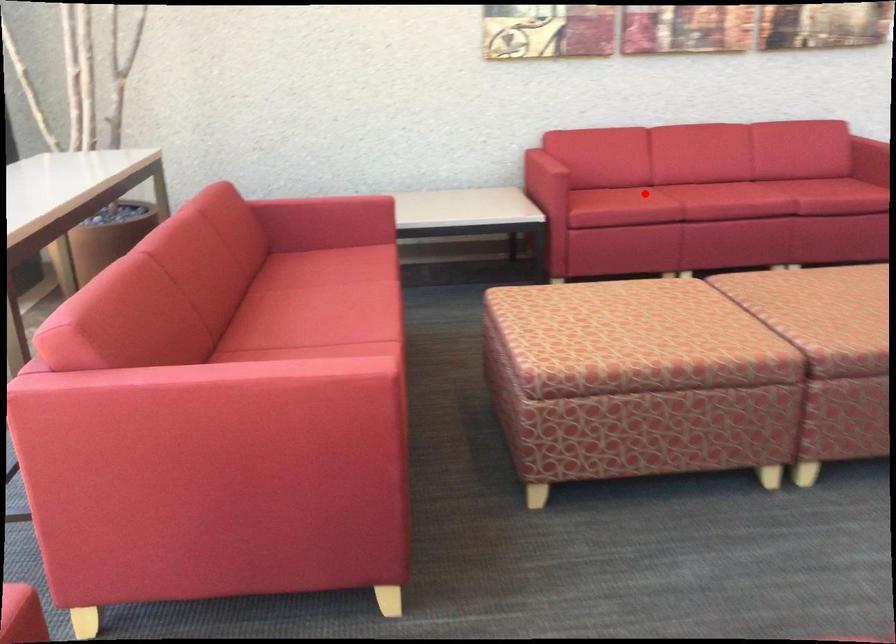
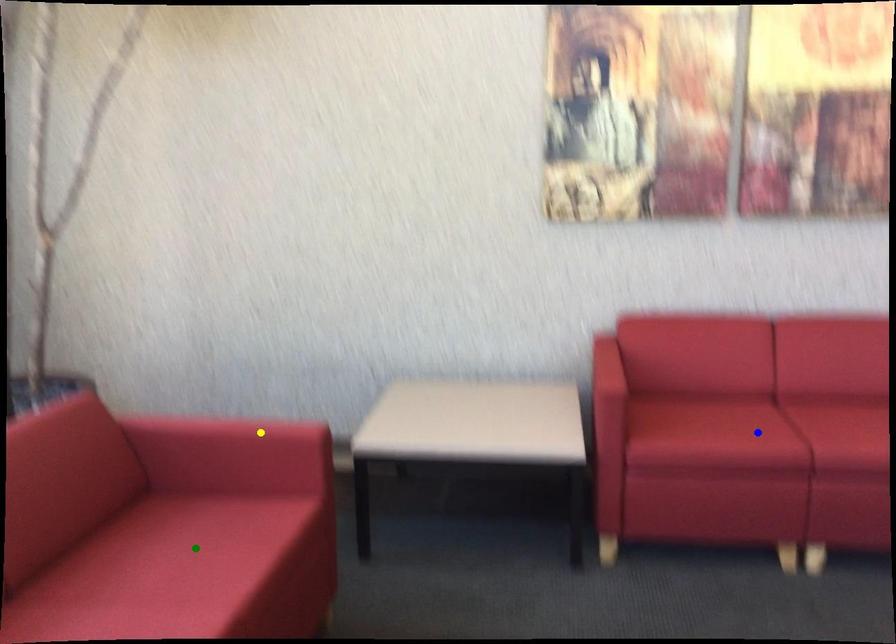
Question: I am providing you with two images of the same scene from different viewpoints. A red point is marked on the first image. You are given multiple points on the second image. Which spot in image 2 lines up with the point in image 1?

Choices:
 (A) green point
 (B) blue point
 (C) yellow point

Answer: (B)